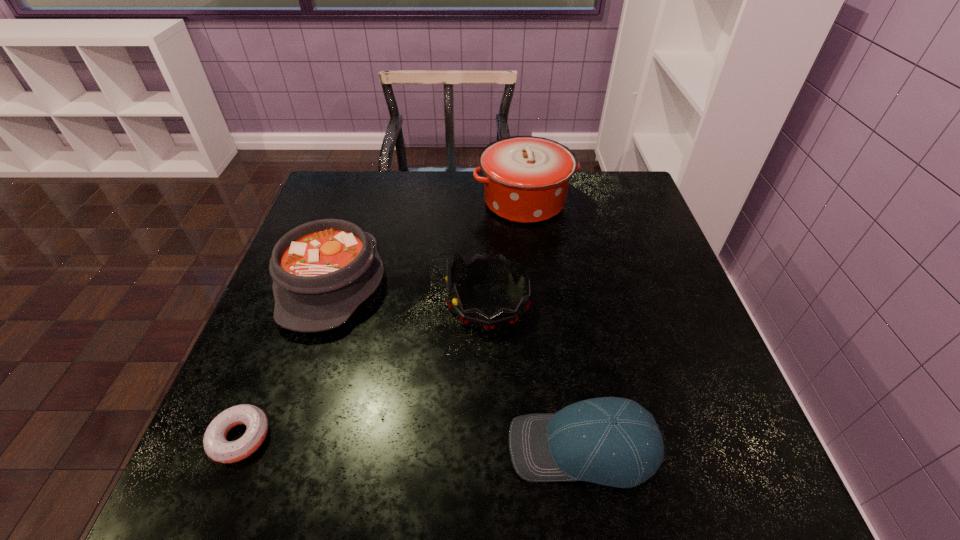
What are the coordinates of `free spot that satisfies the following two spatial constraints: 1. on the back side of the doughnut; 2. on the right side of the farthest object` in the screenshot? It's located at (334, 201).

What are the coordinates of `blank area in the image that satisfies the following two spatial constraints: 1. at the front of the fourth tallest object with jewels; 2. on the left side of the second tallest object` in the screenshot? It's located at (491, 447).